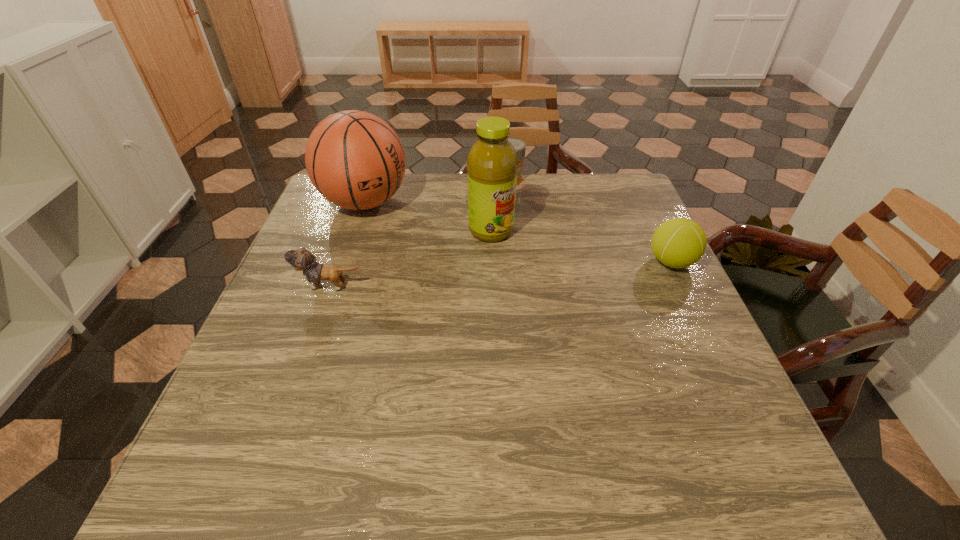
Where is `kitten`? The height and width of the screenshot is (540, 960). kitten is located at coordinates (301, 259).

You are a GUI agent. You are given a task and a screenshot of the screen. Output one action in this format:
    pyautogui.click(x=<x>, y=<y>)
    Task: Click on the tennis ball
    Image resolution: width=960 pixels, height=540 pixels.
    Given the screenshot: What is the action you would take?
    pyautogui.click(x=679, y=242)

You are a GUI agent. You are given a task and a screenshot of the screen. Output one action in this format:
    pyautogui.click(x=<x>, y=<y>)
    Task: Click on the fruit juice
    The image size is (960, 540).
    Given the screenshot: What is the action you would take?
    pyautogui.click(x=492, y=163)

The height and width of the screenshot is (540, 960). Find the location of `basketball`. basketball is located at coordinates (354, 159).

Where is `medicine`? medicine is located at coordinates (520, 146).

This screenshot has height=540, width=960. In order to click on free space located 0.380m on the front of the rightmost object in this screenshot , I will do `click(751, 427)`.

Where is `free space located 0.120m on the front label of the fruit juice`? The height and width of the screenshot is (540, 960). free space located 0.120m on the front label of the fruit juice is located at coordinates (536, 267).

Locate an element on the screen. This screenshot has height=540, width=960. vacant space located on the front label of the fruit juice is located at coordinates (525, 258).

At what (x,y) coordinates should I click in order to perform the action: click on free space located 0.370m on the front label of the fruit juice. Please return your answer as a coordinate pair (x, y). Looking at the image, I should click on (615, 330).

Identify the location of free location located on the surface of the basketball near the brand logo. This screenshot has width=960, height=540. (442, 246).